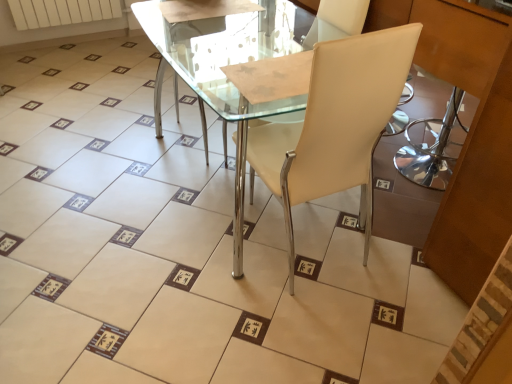
Question: Does transparent glass table at center have a lesser width compared to white matte radiator at upper left?

Choices:
 (A) no
 (B) yes

Answer: (A)

Question: From a real-world perspective, is transparent glass table at center positioned over white matte radiator at upper left based on gravity?

Choices:
 (A) yes
 (B) no

Answer: (A)

Question: Does transparent glass table at center appear on the left side of white matte radiator at upper left?

Choices:
 (A) yes
 (B) no

Answer: (B)

Question: Does transparent glass table at center appear on the right side of white matte radiator at upper left?

Choices:
 (A) no
 (B) yes

Answer: (B)

Question: Does transparent glass table at center have a smaller size compared to white matte radiator at upper left?

Choices:
 (A) no
 (B) yes

Answer: (A)

Question: Would you say transparent glass table at center contains white matte radiator at upper left?

Choices:
 (A) yes
 (B) no

Answer: (B)

Question: Is the surface of white matte radiator at upper left in direct contact with beige leather chair at center?

Choices:
 (A) no
 (B) yes

Answer: (A)

Question: Can you confirm if white matte radiator at upper left is wider than beige leather chair at center?

Choices:
 (A) yes
 (B) no

Answer: (B)

Question: Considering the relative sizes of white matte radiator at upper left and beige leather chair at center in the image provided, is white matte radiator at upper left shorter than beige leather chair at center?

Choices:
 (A) no
 (B) yes

Answer: (B)

Question: Is beige leather chair at center completely or partially inside white matte radiator at upper left?

Choices:
 (A) no
 (B) yes

Answer: (A)

Question: Can you confirm if white matte radiator at upper left is thinner than beige leather chair at center?

Choices:
 (A) no
 (B) yes

Answer: (B)

Question: Is white matte radiator at upper left smaller than beige leather chair at center?

Choices:
 (A) yes
 (B) no

Answer: (A)

Question: Considering the relative sizes of beige leather chair at center and white matte radiator at upper left in the image provided, is beige leather chair at center smaller than white matte radiator at upper left?

Choices:
 (A) yes
 (B) no

Answer: (B)